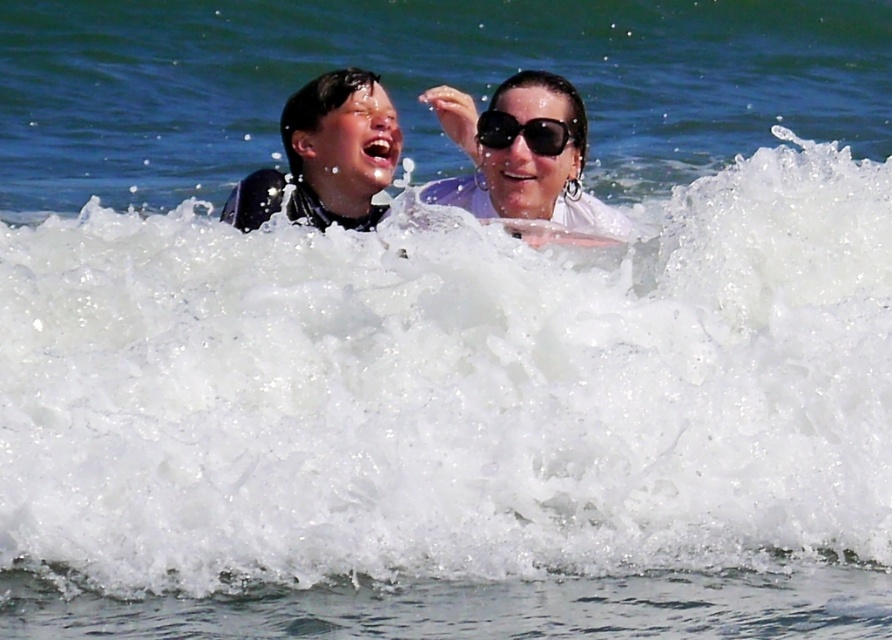
You are a photographer trying to capture a clear shot of the white matte sunglasses at upper center and the black matte wetsuit at left. Since you want to focus on the sunglasses, which object should you adjust your camera focus to prioritize, considering their relative sizes in the frame?

The white matte sunglasses at upper center has a greater height compared to the black matte wetsuit at left, so you should prioritize focusing on the white matte sunglasses at upper center since it is larger in the frame.

You are a photographer trying to capture the perfect shot of the scene. The white matte sunglasses at upper center are located at point 0.242 on the horizontal axis and 0.586 on the vertical axis. To ensure the sunglasses are centered in your frame, you need to adjust your camera. What adjustment should you make to the camera position?

To center the white matte sunglasses at upper center in the frame, adjust the camera so that it aligns with the coordinates provided, moving horizontally to 0.242 and vertically to 0.586.

You are a photographer trying to capture a clear shot of the white matte sunglasses at upper center and the black matte wetsuit at left. Since you want to focus on the sunglasses, which object should you zoom in on more, and why?

You should zoom in more on the white matte sunglasses at upper center because its width is larger than the black matte wetsuit at left, making it easier to focus on.